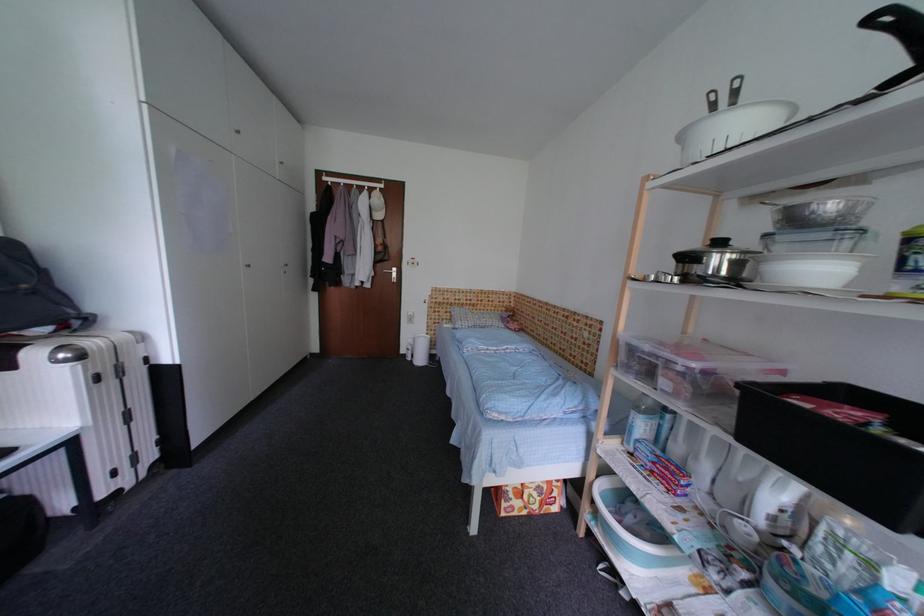
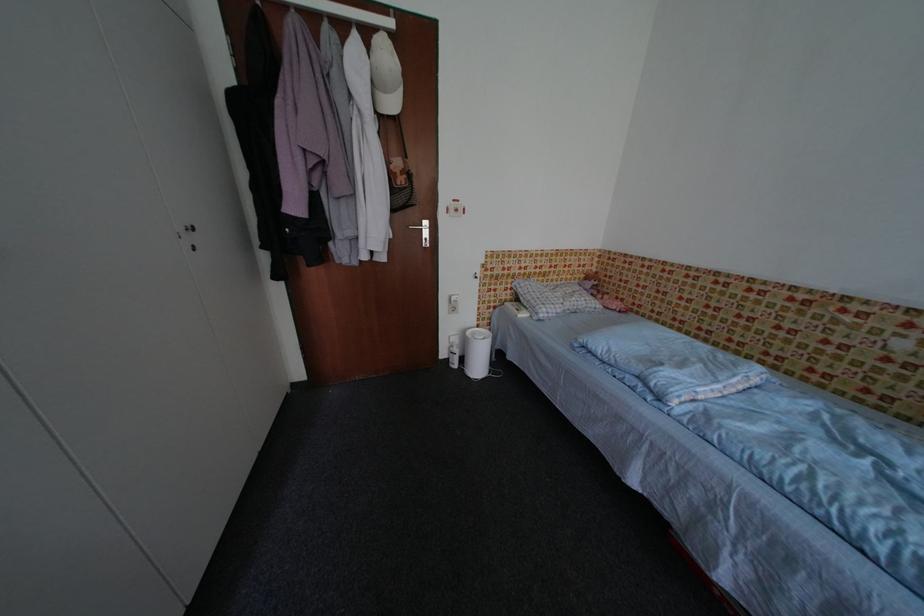
Where in the second image is the point corresponding to point 455,322 from the first image?

(514, 302)